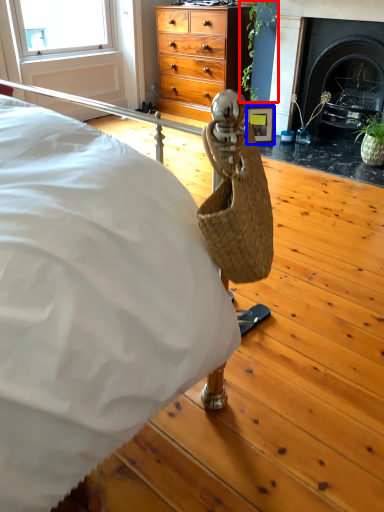
Question: Which point is closer to the camera, plant (highlighted by a red box) or picture frame (highlighted by a blue box)?

Choices:
 (A) plant
 (B) picture frame

Answer: (A)